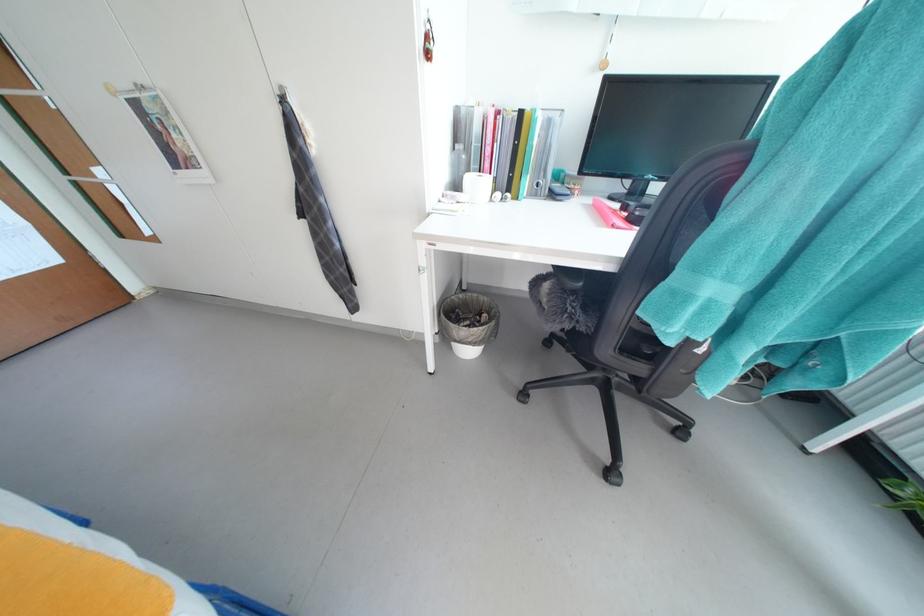
What are the coordinates of `metal wall hook` in the screenshot? It's located at (608, 46).